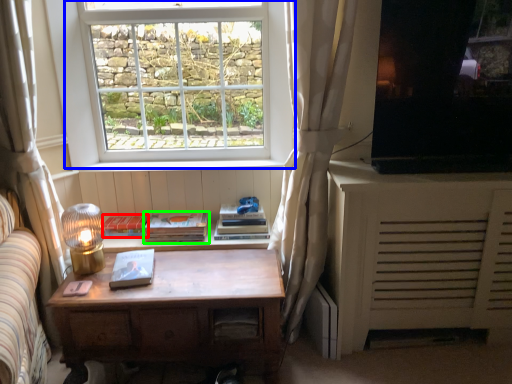
Question: Based on their relative distances, which object is farther from paperback book (highlighted by a red box)? Choose from window (highlighted by a blue box) and paperback book (highlighted by a green box).

Choices:
 (A) window
 (B) paperback book

Answer: (A)